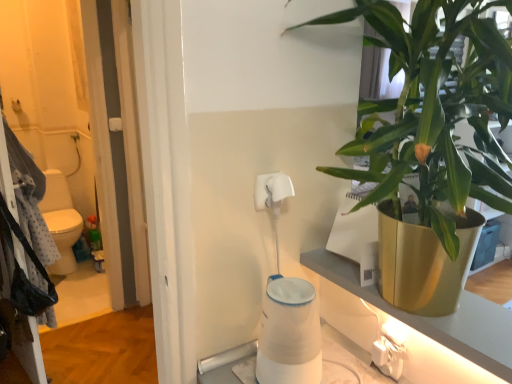
At what (x,y) coordinates should I click in order to perform the action: click on vacant space positioned to the left of white plastic electric outlet at lower right. Please return your answer as a coordinate pair (x, y). The image size is (512, 384). Looking at the image, I should click on (345, 367).